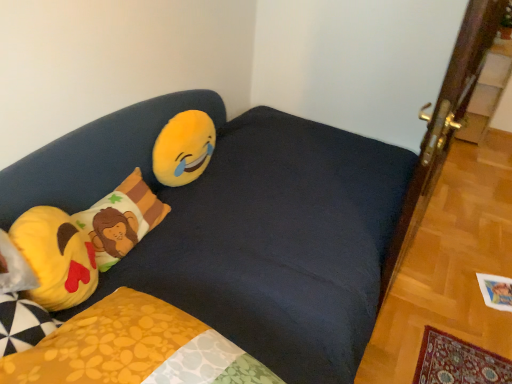
Find the location of a particular element. The width and height of the screenshot is (512, 384). dark blue fabric studio couch at upper left is located at coordinates (243, 226).

This screenshot has height=384, width=512. Identify the location of yellow plush emoji at upper left. (183, 148).

Locate an element on the screen. Image resolution: width=512 pixels, height=384 pixels. fluffy cotton pillow with lion design at left, placed as the 1th pillow when sorted from back to front is located at coordinates (121, 219).

Is fluffy cotton pillow with lion design at left, placed as the 1th pillow when sorted from back to front, smaller than yellow plush emoji at left, which is the 1th pillow in front-to-back order?

Yes, fluffy cotton pillow with lion design at left, placed as the 1th pillow when sorted from back to front, is smaller than yellow plush emoji at left, which is the 1th pillow in front-to-back order.

From the image's perspective, who appears lower, fluffy cotton pillow with lion design at left, placed as the 1th pillow when sorted from back to front, or yellow plush emoji at left, the 2th pillow viewed from the back?

yellow plush emoji at left, the 2th pillow viewed from the back.

Can we say fluffy cotton pillow with lion design at left, placed as the 1th pillow when sorted from back to front, lies outside yellow plush emoji at left, the 2th pillow viewed from the back?

Yes.

Does point (110, 266) come behind point (93, 255)?

Yes.

Which is behind, point (102, 250) or point (201, 111)?

The point (201, 111) is farther from the camera.

Find the location of a particular element. toy above the fluffy cotton pillow with lion design at left, acting as the 2th pillow starting from the front (from a real-world perspective) is located at coordinates (183, 148).

From the picture: Can you tell me how much fluffy cotton pillow with lion design at left, placed as the 1th pillow when sorted from back to front, and yellow plush emoji at upper left differ in facing direction?

6.14 degrees.

From the image's perspective, between dark blue fabric studio couch at upper left and fluffy cotton pillow with lion design at left, acting as the 2th pillow starting from the front, which one is located above?

From the image's view, fluffy cotton pillow with lion design at left, acting as the 2th pillow starting from the front, is above.

Consider the image. Is dark blue fabric studio couch at upper left not close to fluffy cotton pillow with lion design at left, acting as the 2th pillow starting from the front?

Actually, dark blue fabric studio couch at upper left and fluffy cotton pillow with lion design at left, acting as the 2th pillow starting from the front, are a little close together.

Which is in front, dark blue fabric studio couch at upper left or fluffy cotton pillow with lion design at left, placed as the 1th pillow when sorted from back to front?

dark blue fabric studio couch at upper left is in front.

Who is bigger, dark blue fabric studio couch at upper left or fluffy cotton pillow with lion design at left, acting as the 2th pillow starting from the front?

dark blue fabric studio couch at upper left.

Can yellow plush emoji at upper left be found inside dark blue fabric studio couch at upper left?

Yes, yellow plush emoji at upper left is a part of dark blue fabric studio couch at upper left.

Considering the relative sizes of dark blue fabric studio couch at upper left and yellow plush emoji at upper left in the image provided, is dark blue fabric studio couch at upper left thinner than yellow plush emoji at upper left?

No, dark blue fabric studio couch at upper left is not thinner than yellow plush emoji at upper left.

In the scene shown: Who is shorter, dark blue fabric studio couch at upper left or yellow plush emoji at upper left?

Standing shorter between the two is yellow plush emoji at upper left.

From the image's perspective, which object appears higher, yellow plush emoji at upper left or fluffy cotton pillow with lion design at left, acting as the 2th pillow starting from the front?

yellow plush emoji at upper left.

Measure the distance from yellow plush emoji at upper left to fluffy cotton pillow with lion design at left, acting as the 2th pillow starting from the front.

They are 8.80 inches apart.

Considering the relative positions of yellow plush emoji at upper left and fluffy cotton pillow with lion design at left, acting as the 2th pillow starting from the front, in the image provided, is yellow plush emoji at upper left to the left or to the right of fluffy cotton pillow with lion design at left, acting as the 2th pillow starting from the front,?

Clearly, yellow plush emoji at upper left is on the right of fluffy cotton pillow with lion design at left, acting as the 2th pillow starting from the front, in the image.

Is yellow plush emoji at upper left bigger or smaller than fluffy cotton pillow with lion design at left, acting as the 2th pillow starting from the front?

yellow plush emoji at upper left is smaller than fluffy cotton pillow with lion design at left, acting as the 2th pillow starting from the front.

Between dark blue fabric studio couch at upper left and yellow plush emoji at left, which is the 1th pillow in front-to-back order, which one appears on the left side from the viewer's perspective?

From the viewer's perspective, yellow plush emoji at left, which is the 1th pillow in front-to-back order, appears more on the left side.

Locate an element on the screen. This screenshot has height=384, width=512. pillow below the dark blue fabric studio couch at upper left (from the image's perspective) is located at coordinates (56, 257).

Is dark blue fabric studio couch at upper left looking in the opposite direction of yellow plush emoji at left, the 2th pillow viewed from the back?

That's right, dark blue fabric studio couch at upper left is facing away from yellow plush emoji at left, the 2th pillow viewed from the back.

Can you tell me how much dark blue fabric studio couch at upper left and yellow plush emoji at left, the 2th pillow viewed from the back, differ in facing direction?

78.2 degrees.

Is yellow plush emoji at left, the 2th pillow viewed from the back, situated inside dark blue fabric studio couch at upper left or outside?

The correct answer is: inside.

From a real-world perspective, is yellow plush emoji at left, the 2th pillow viewed from the back, located higher than dark blue fabric studio couch at upper left?

Yes, from a real-world perspective, yellow plush emoji at left, the 2th pillow viewed from the back, is on top of dark blue fabric studio couch at upper left.

Is yellow plush emoji at left, which is the 1th pillow in front-to-back order, looking in the opposite direction of dark blue fabric studio couch at upper left?

Yes.

Considering the points (41, 272) and (139, 275), which point is behind, point (41, 272) or point (139, 275)?

The point (139, 275) is farther.

The height and width of the screenshot is (384, 512). I want to click on pillow above the yellow plush emoji at left, which is the 1th pillow in front-to-back order (from the image's perspective), so click(x=121, y=219).

This screenshot has width=512, height=384. I want to click on pillow that is the 1st object located below the yellow plush emoji at upper left (from the image's perspective), so click(x=121, y=219).

Which object lies nearer to the anchor point yellow plush emoji at upper left, dark blue fabric studio couch at upper left or fluffy cotton pillow with lion design at left, acting as the 2th pillow starting from the front?

Among the two, fluffy cotton pillow with lion design at left, acting as the 2th pillow starting from the front, is located nearer to yellow plush emoji at upper left.

From the image, which object appears to be farther from dark blue fabric studio couch at upper left, yellow plush emoji at left, which is the 1th pillow in front-to-back order, or fluffy cotton pillow with lion design at left, acting as the 2th pillow starting from the front?

yellow plush emoji at left, which is the 1th pillow in front-to-back order.

Which object lies further to the anchor point yellow plush emoji at upper left, dark blue fabric studio couch at upper left or yellow plush emoji at left, the 2th pillow viewed from the back?

yellow plush emoji at left, the 2th pillow viewed from the back, is positioned further to the anchor yellow plush emoji at upper left.

Which object lies further to the anchor point fluffy cotton pillow with lion design at left, placed as the 1th pillow when sorted from back to front, yellow plush emoji at upper left or dark blue fabric studio couch at upper left?

The object further to fluffy cotton pillow with lion design at left, placed as the 1th pillow when sorted from back to front, is dark blue fabric studio couch at upper left.

Estimate the real-world distances between objects in this image. Which object is closer to fluffy cotton pillow with lion design at left, acting as the 2th pillow starting from the front, yellow plush emoji at left, which is the 1th pillow in front-to-back order, or yellow plush emoji at upper left?

Based on the image, yellow plush emoji at left, which is the 1th pillow in front-to-back order, appears to be nearer to fluffy cotton pillow with lion design at left, acting as the 2th pillow starting from the front.

Which object lies nearer to the anchor point yellow plush emoji at left, which is the 1th pillow in front-to-back order, fluffy cotton pillow with lion design at left, acting as the 2th pillow starting from the front, or yellow plush emoji at upper left?

fluffy cotton pillow with lion design at left, acting as the 2th pillow starting from the front, is closer to yellow plush emoji at left, which is the 1th pillow in front-to-back order.

Based on their spatial positions, is fluffy cotton pillow with lion design at left, placed as the 1th pillow when sorted from back to front, or yellow plush emoji at upper left further from dark blue fabric studio couch at upper left?

yellow plush emoji at upper left.

Estimate the real-world distances between objects in this image. Which object is further from fluffy cotton pillow with lion design at left, acting as the 2th pillow starting from the front, yellow plush emoji at upper left or yellow plush emoji at left, the 2th pillow viewed from the back?

Based on the image, yellow plush emoji at upper left appears to be further to fluffy cotton pillow with lion design at left, acting as the 2th pillow starting from the front.

Where is `pillow between yellow plush emoji at left, which is the 1th pillow in front-to-back order, and yellow plush emoji at upper left in the front-back direction`? pillow between yellow plush emoji at left, which is the 1th pillow in front-to-back order, and yellow plush emoji at upper left in the front-back direction is located at coordinates (121, 219).

This screenshot has height=384, width=512. Identify the location of pillow positioned between dark blue fabric studio couch at upper left and fluffy cotton pillow with lion design at left, placed as the 1th pillow when sorted from back to front, from near to far. (56, 257).